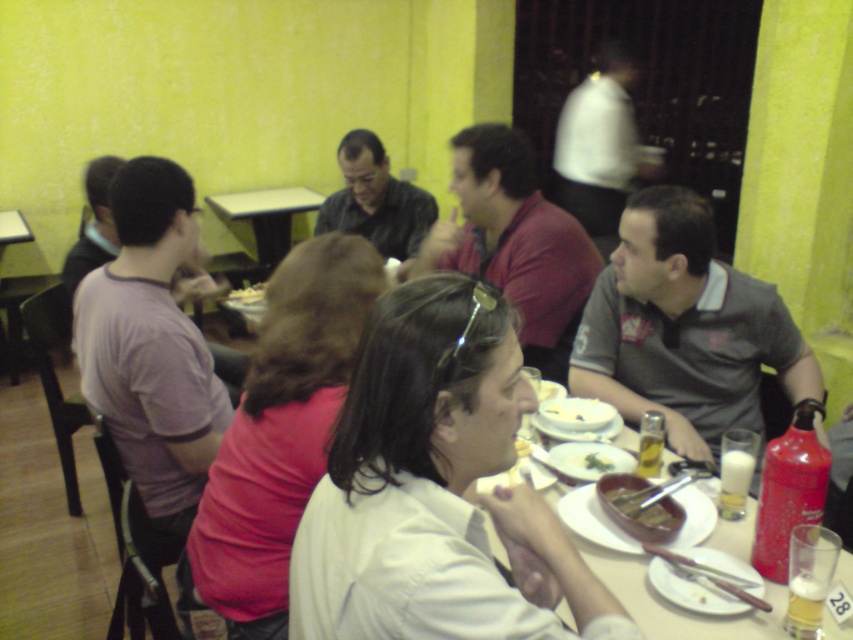
At what (x,y) coordinates should I click in order to perform the action: click on white matte shirt at center. Please return your answer as a coordinate pair (x, y). The width and height of the screenshot is (853, 640). Looking at the image, I should click on (434, 490).

Which of these two, white matte shirt at center or white matte plate at center, stands shorter?

Standing shorter between the two is white matte plate at center.

What do you see at coordinates (434, 490) in the screenshot? This screenshot has width=853, height=640. I see `white matte shirt at center` at bounding box center [434, 490].

Locate an element on the screen. white matte shirt at center is located at coordinates (434, 490).

The width and height of the screenshot is (853, 640). Identify the location of purple cotton shirt at left. (151, 346).

Can you confirm if purple cotton shirt at left is shorter than white glossy table at center?

Incorrect, purple cotton shirt at left's height does not fall short of white glossy table at center's.

Who is more distant from viewer, [184,529] or [634,584]?

Positioned behind is point [184,529].

In order to click on purple cotton shirt at left in this screenshot , I will do `click(151, 346)`.

Based on the photo, between white matte shirt at center and gray fabric shirt at right, which one is positioned higher?

gray fabric shirt at right is higher up.

Can you confirm if white matte shirt at center is shorter than gray fabric shirt at right?

Indeed, white matte shirt at center has a lesser height compared to gray fabric shirt at right.

Is point (364, 419) closer to camera compared to point (712, 323)?

That is True.

This screenshot has width=853, height=640. I want to click on white matte shirt at center, so click(x=434, y=490).